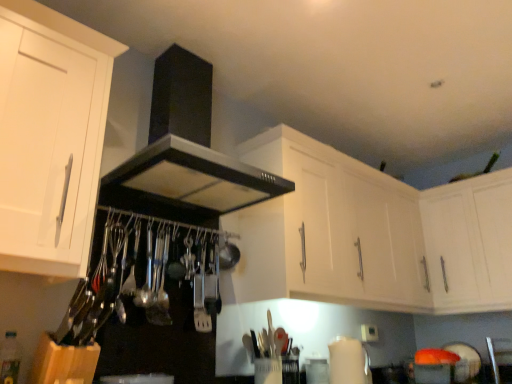
Locate an element on the screen. The image size is (512, 384). free space above black matte exhaust hood at upper center (from a real-world perspective) is located at coordinates (194, 41).